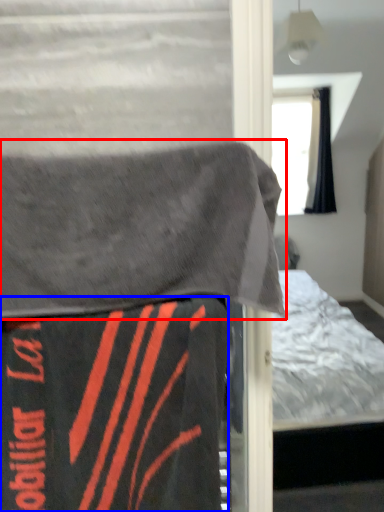
Question: Which point is closer to the camera, blanket (highlighted by a red box) or blanket (highlighted by a blue box)?

Choices:
 (A) blanket
 (B) blanket

Answer: (A)